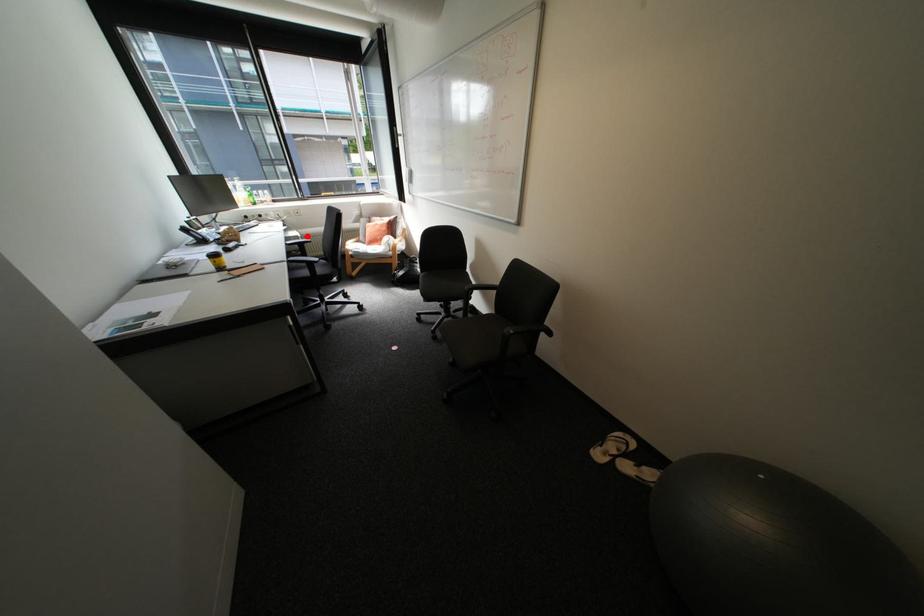
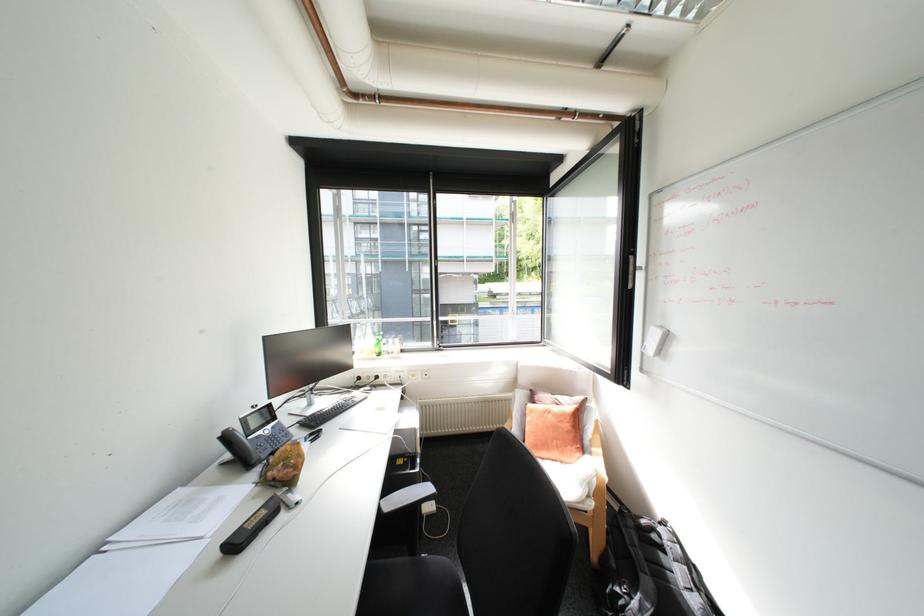
Where in the second image is the point corresponding to the highlighted location from the first image?

(424, 429)